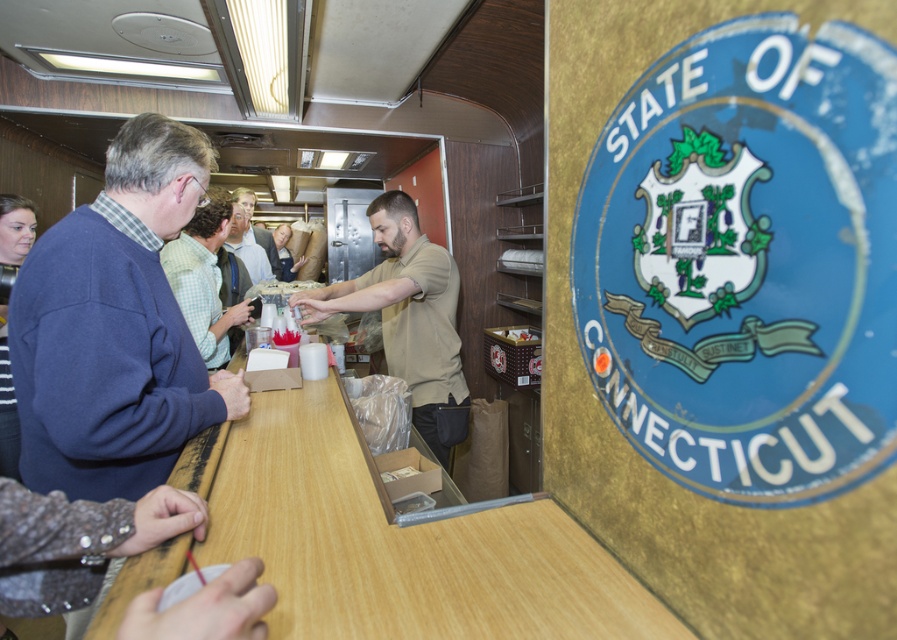
You are a customer in the food service area. You see the wooden at center and the matte khaki shirt at center. Which object is closer to you?

The wooden at center is closer to you because it is in front of the matte khaki shirt at center.

You are a customer at the counter and want to know which of the two shirts at the center is wider. The staff members are wearing a matte khaki shirt at center and a green plaid shirt at center. Can you tell me which one is wider?

The matte khaki shirt at center is wider than the green plaid shirt at center according to the description.